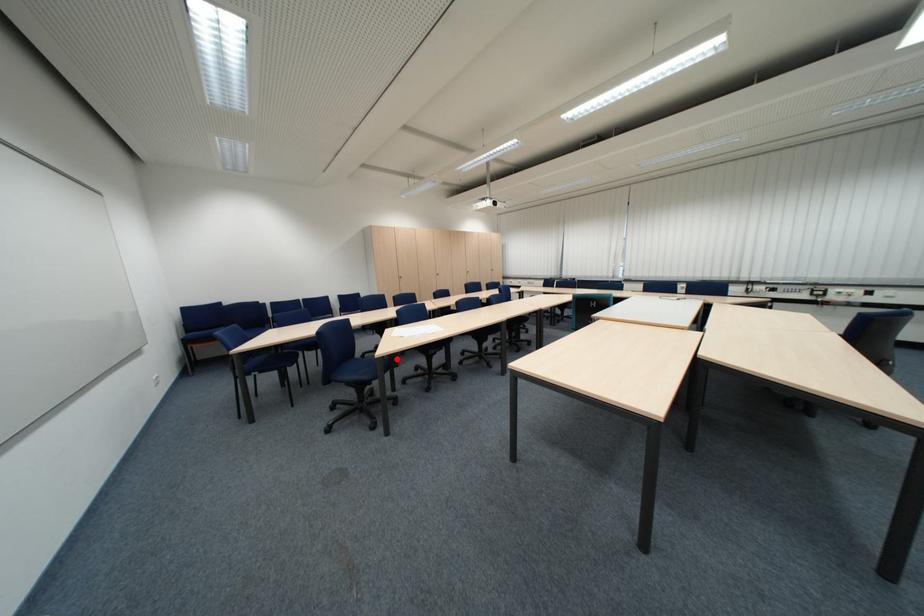
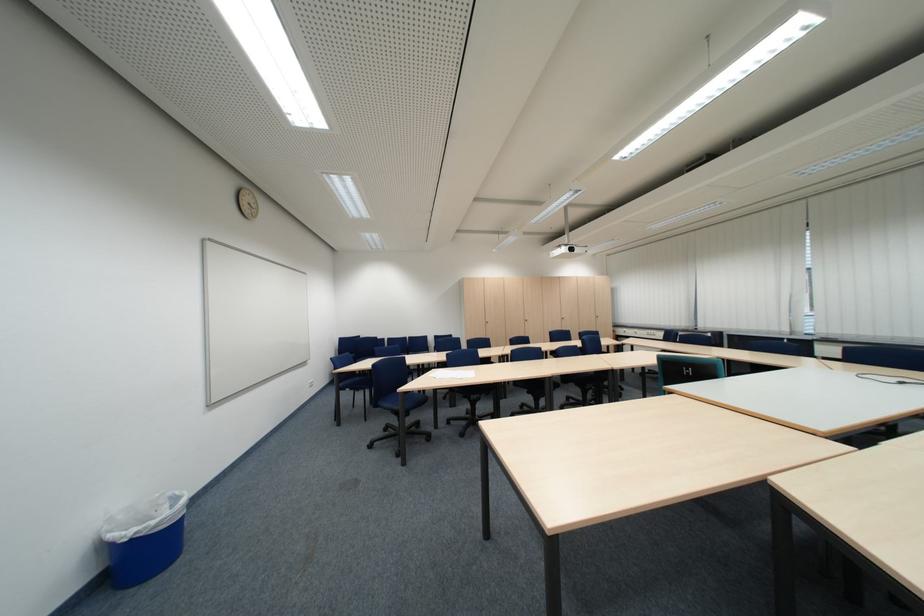
In the second image, find the point that corresponds to the highlighted location in the first image.

(419, 394)